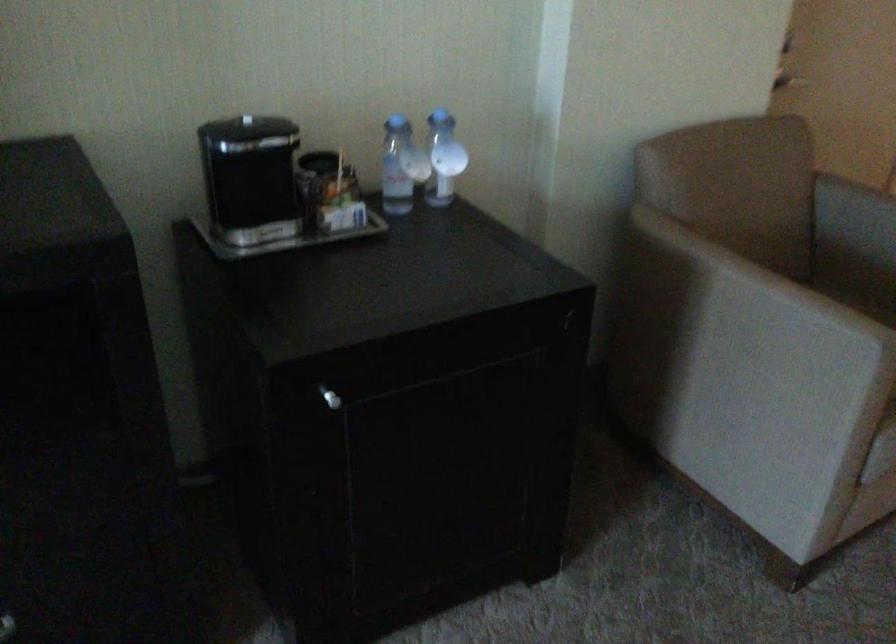
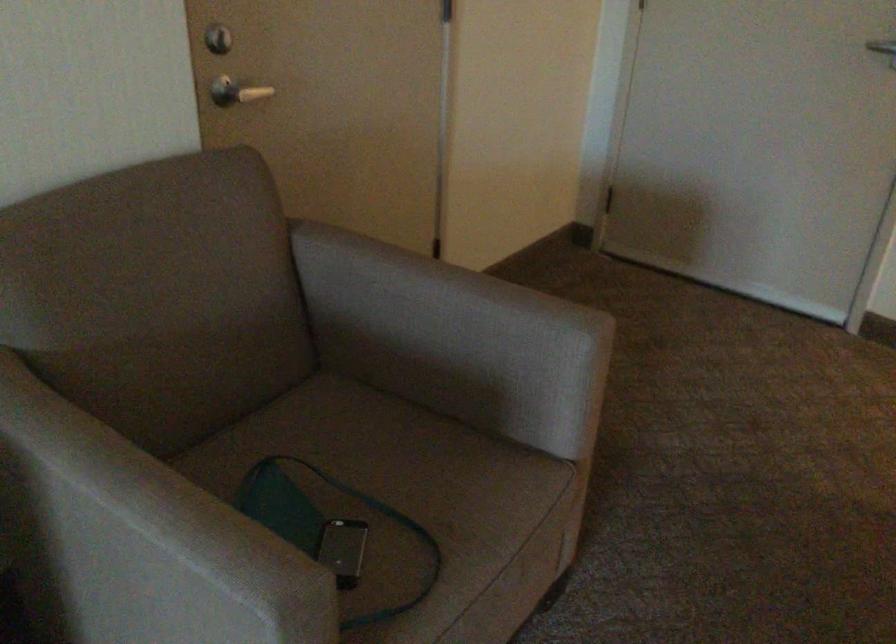
What movement of the cameraman would produce the second image?

The cameraman walked toward right, forward.